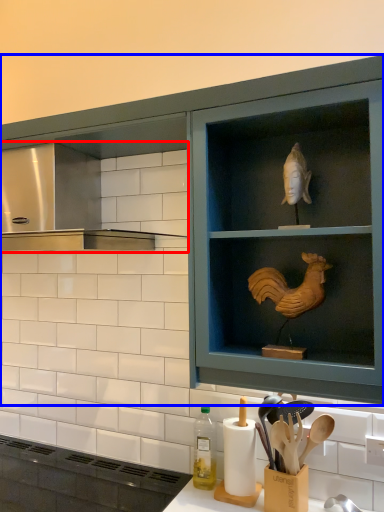
Question: Which of the following is the farthest to the observer, vent (highlighted by a red box) or cabinetry (highlighted by a blue box)?

Choices:
 (A) vent
 (B) cabinetry

Answer: (B)